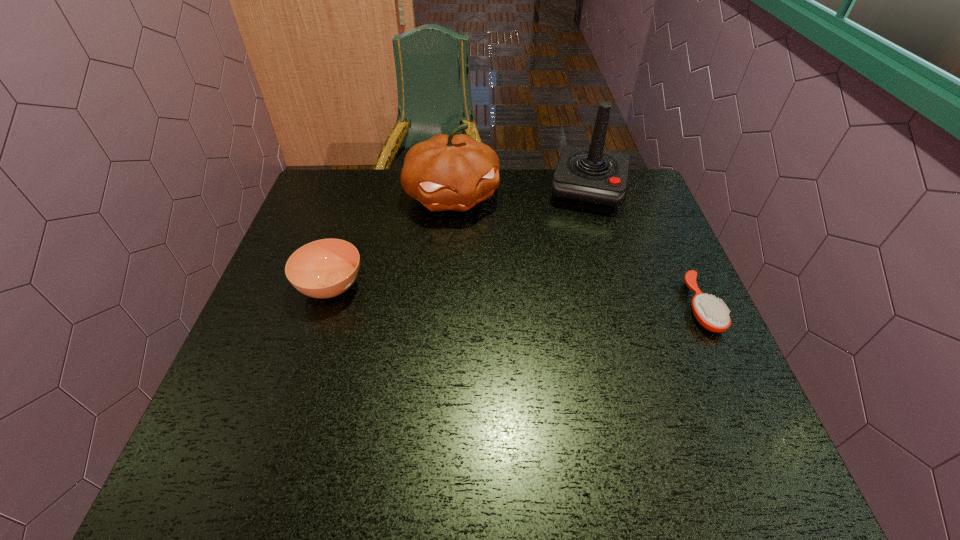
At what (x,y) coordinates should I click in order to perform the action: click on joystick at the right edge. Please return your answer as a coordinate pair (x, y). Image resolution: width=960 pixels, height=540 pixels. Looking at the image, I should click on (593, 178).

Where is `object located in the far right corner section of the desktop`? object located in the far right corner section of the desktop is located at coordinates (593, 178).

You are a GUI agent. You are given a task and a screenshot of the screen. Output one action in this format:
    pyautogui.click(x=<x>, y=<y>)
    Task: Click on the vacant space at the far edge of the desktop
    This screenshot has width=960, height=540.
    Given the screenshot: What is the action you would take?
    pyautogui.click(x=553, y=206)

The image size is (960, 540). In order to click on vacant space at the near edge of the desktop in this screenshot , I will do `click(410, 387)`.

Locate an element on the screen. vacant region at the left edge is located at coordinates (283, 377).

Locate an element on the screen. vacant area at the right edge is located at coordinates (666, 300).

You are a GUI agent. You are given a task and a screenshot of the screen. Output one action in this format:
    pyautogui.click(x=<x>, y=<y>)
    Task: Click on the free spot at the far left corner of the desktop
    The width and height of the screenshot is (960, 540).
    Given the screenshot: What is the action you would take?
    pyautogui.click(x=358, y=194)

Image resolution: width=960 pixels, height=540 pixels. I want to click on free space at the near left corner of the desktop, so click(x=261, y=411).

Locate an element on the screen. free space that is in between the shortest object and the joystick is located at coordinates (644, 249).

The height and width of the screenshot is (540, 960). In order to click on free spot between the soup bowl and the hairbrush in this screenshot , I will do `click(516, 296)`.